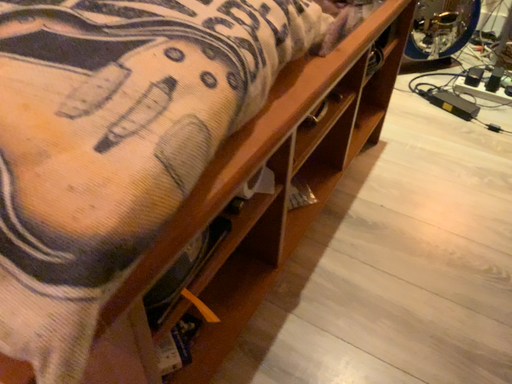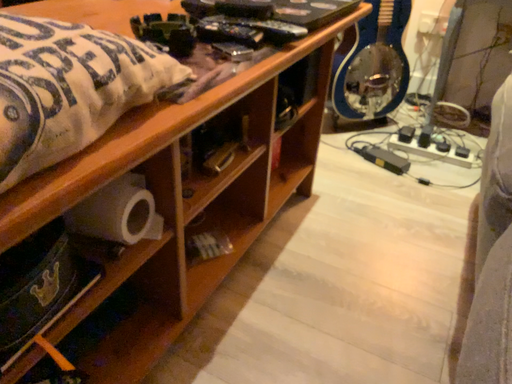
Question: Which way did the camera rotate in the video?

Choices:
 (A) rotated upward
 (B) rotated downward

Answer: (A)